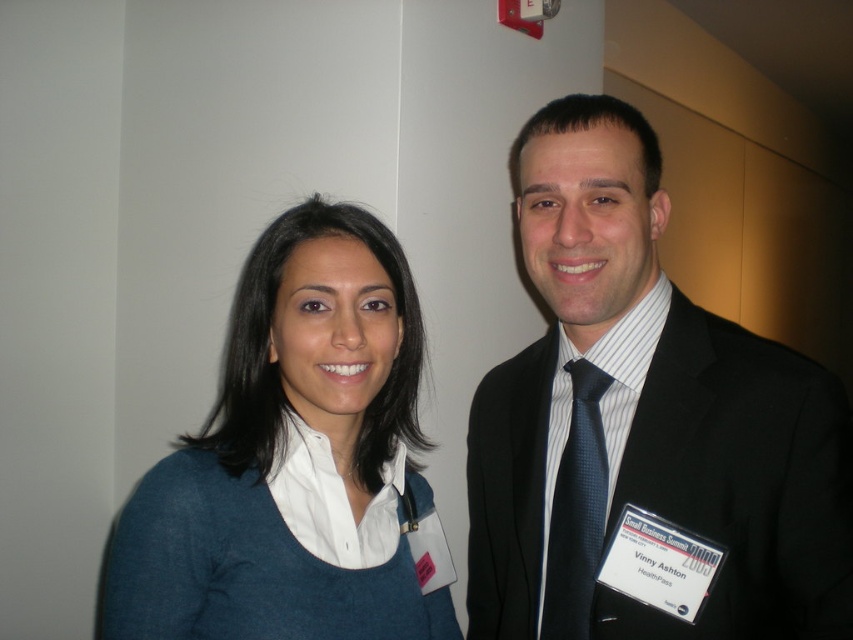
Question: Does blue fabric shirt at left come behind black textured tie at right?

Choices:
 (A) yes
 (B) no

Answer: (B)

Question: Which point is closer to the camera?

Choices:
 (A) (547, 550)
 (B) (352, 390)

Answer: (B)

Question: Which is nearer to the blue fabric shirt at left?

Choices:
 (A) black suit at center
 (B) black textured tie at right

Answer: (A)

Question: Is blue fabric shirt at left smaller than black textured tie at right?

Choices:
 (A) yes
 (B) no

Answer: (B)

Question: Does black suit at center appear on the right side of blue fabric shirt at left?

Choices:
 (A) yes
 (B) no

Answer: (A)

Question: Estimate the real-world distances between objects in this image. Which object is closer to the blue fabric shirt at left?

Choices:
 (A) black textured tie at right
 (B) black suit at center

Answer: (B)